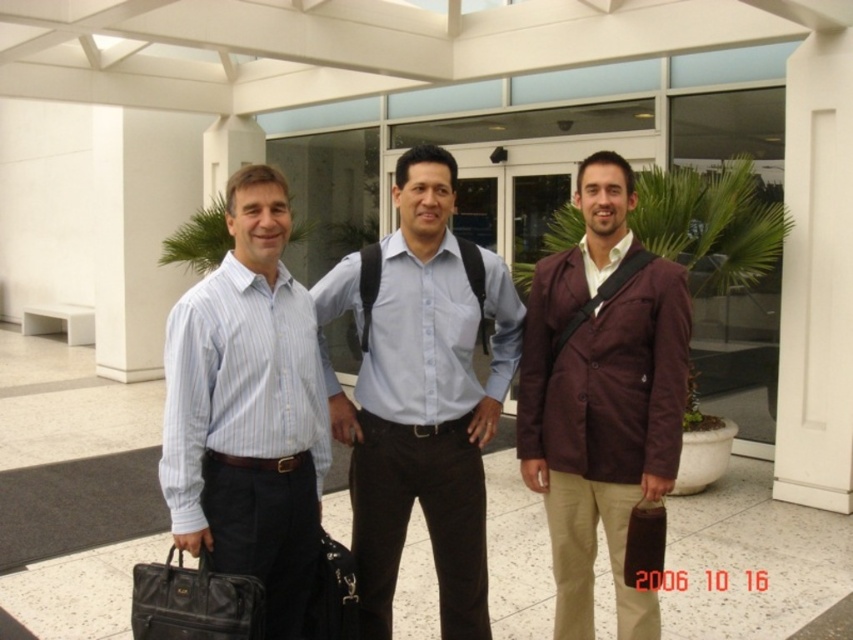
Is point (618, 358) in front of point (303, 516)?

No, (618, 358) is further to viewer.

Can you confirm if maroon textured blazer at center is shorter than light blue striped shirt at center?

No.

What do you see at coordinates (601, 396) in the screenshot?
I see `maroon textured blazer at center` at bounding box center [601, 396].

In order to click on maroon textured blazer at center in this screenshot , I will do `click(601, 396)`.

How far apart are light blue shirt at center and black leather briefcase at lower left?

light blue shirt at center is 31.40 inches away from black leather briefcase at lower left.

The width and height of the screenshot is (853, 640). Describe the element at coordinates (421, 394) in the screenshot. I see `light blue shirt at center` at that location.

This screenshot has width=853, height=640. What do you see at coordinates (421, 394) in the screenshot?
I see `light blue shirt at center` at bounding box center [421, 394].

Find the location of a particular element. This screenshot has height=640, width=853. light blue shirt at center is located at coordinates (421, 394).

Who is higher up, light blue striped shirt at center or brown leather briefcase at center?

light blue striped shirt at center is above.

Image resolution: width=853 pixels, height=640 pixels. Describe the element at coordinates (248, 410) in the screenshot. I see `light blue striped shirt at center` at that location.

In order to click on light blue striped shirt at center in this screenshot , I will do [248, 410].